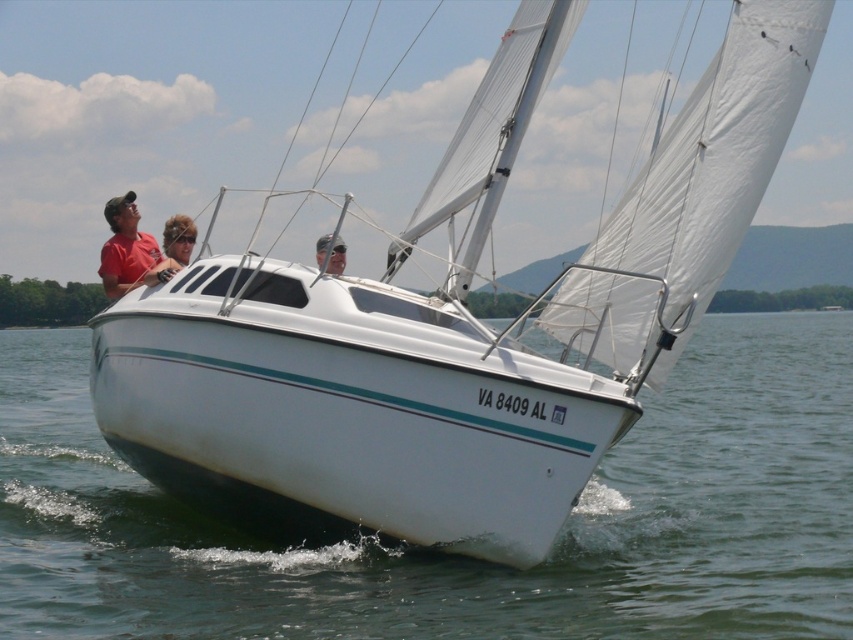
Question: Is matte red shirt at upper left smaller than matte pink hair at center?

Choices:
 (A) yes
 (B) no

Answer: (A)

Question: Which object is the closest to the blonde hair at center?

Choices:
 (A) matte pink hair at center
 (B) matte red shirt at upper left
 (C) white water at lower center

Answer: (B)

Question: Which of the following is the farthest from the observer?

Choices:
 (A) matte red shirt at upper left
 (B) blonde hair at center
 (C) matte pink hair at center

Answer: (B)

Question: Does white water at lower center appear on the right side of matte pink hair at center?

Choices:
 (A) no
 (B) yes

Answer: (A)

Question: Does white water at lower center have a larger size compared to matte pink hair at center?

Choices:
 (A) no
 (B) yes

Answer: (B)

Question: Which object appears farthest from the camera in this image?

Choices:
 (A) white water at lower center
 (B) matte red shirt at upper left
 (C) matte pink hair at center
 (D) blonde hair at center

Answer: (D)